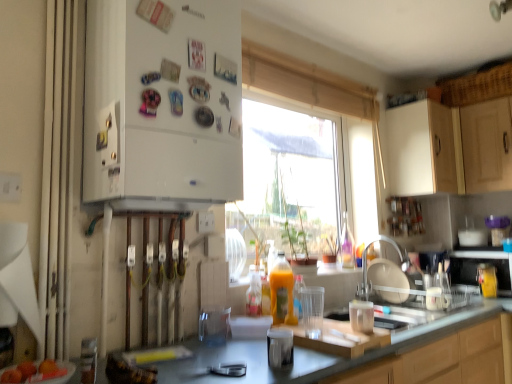
Question: Is smooth orange fruit at lower left at the back of white fabric curtain at left?

Choices:
 (A) yes
 (B) no

Answer: (B)

Question: From the image's perspective, does white fabric curtain at left appear higher than smooth orange fruit at lower left?

Choices:
 (A) no
 (B) yes

Answer: (B)

Question: Does white fabric curtain at left have a larger size compared to smooth orange fruit at lower left?

Choices:
 (A) no
 (B) yes

Answer: (B)

Question: Considering the relative positions of white fabric curtain at left and smooth orange fruit at lower left in the image provided, is white fabric curtain at left to the left of smooth orange fruit at lower left from the viewer's perspective?

Choices:
 (A) no
 (B) yes

Answer: (B)

Question: From a real-world perspective, is white fabric curtain at left located beneath smooth orange fruit at lower left?

Choices:
 (A) no
 (B) yes

Answer: (A)

Question: Does white fabric curtain at left lie behind smooth orange fruit at lower left?

Choices:
 (A) no
 (B) yes

Answer: (B)

Question: Is transparent plastic coffee machine at right to the left of smooth orange fruit at lower left from the viewer's perspective?

Choices:
 (A) yes
 (B) no

Answer: (B)

Question: Does transparent plastic coffee machine at right turn towards smooth orange fruit at lower left?

Choices:
 (A) yes
 (B) no

Answer: (B)

Question: Can you confirm if transparent plastic coffee machine at right is taller than smooth orange fruit at lower left?

Choices:
 (A) yes
 (B) no

Answer: (A)

Question: Is the surface of transparent plastic coffee machine at right in direct contact with smooth orange fruit at lower left?

Choices:
 (A) yes
 (B) no

Answer: (B)

Question: From the image's perspective, is transparent plastic coffee machine at right under smooth orange fruit at lower left?

Choices:
 (A) yes
 (B) no

Answer: (A)

Question: Is smooth orange fruit at lower left surrounded by transparent plastic coffee machine at right?

Choices:
 (A) no
 (B) yes

Answer: (A)

Question: From a real-world perspective, is metallic silver microwave at right, which is counted as the first appliance, starting from the right, located beneath translucent plastic bottle at center?

Choices:
 (A) no
 (B) yes

Answer: (B)